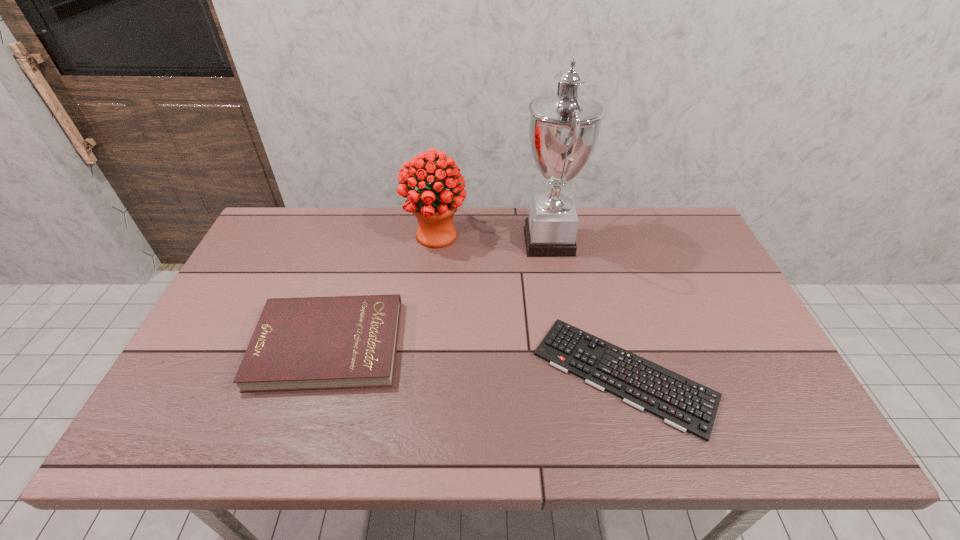
Where is `trophy cup`? This screenshot has width=960, height=540. trophy cup is located at coordinates (564, 127).

You are a GUI agent. You are given a task and a screenshot of the screen. Output one action in this format:
    pyautogui.click(x=<x>, y=<y>)
    Task: Click on the second tallest object
    The image size is (960, 540).
    Given the screenshot: What is the action you would take?
    pyautogui.click(x=434, y=206)

The height and width of the screenshot is (540, 960). Find the location of `hardback book`. hardback book is located at coordinates (307, 343).

I want to click on computer keyboard, so click(682, 403).

Locate an element on the screen. vacant space located at the front view of the tallest object is located at coordinates (396, 241).

Identify the location of free space located at the front view of the tallest object. (436, 241).

I want to click on vacant position located 0.310m at the front view of the tallest object, so click(423, 241).

At what (x,y) coordinates should I click in order to perform the action: click on vacant space located 0.130m on the front of the third shortest object. Please return your answer as a coordinate pair (x, y). This screenshot has width=960, height=540. Looking at the image, I should click on pyautogui.click(x=430, y=286).

Find the location of a particular element. The image size is (960, 540). free space located on the back of the hardback book is located at coordinates coord(366,221).

Locate an element on the screen. This screenshot has width=960, height=540. free space located on the back of the computer keyboard is located at coordinates (590, 255).